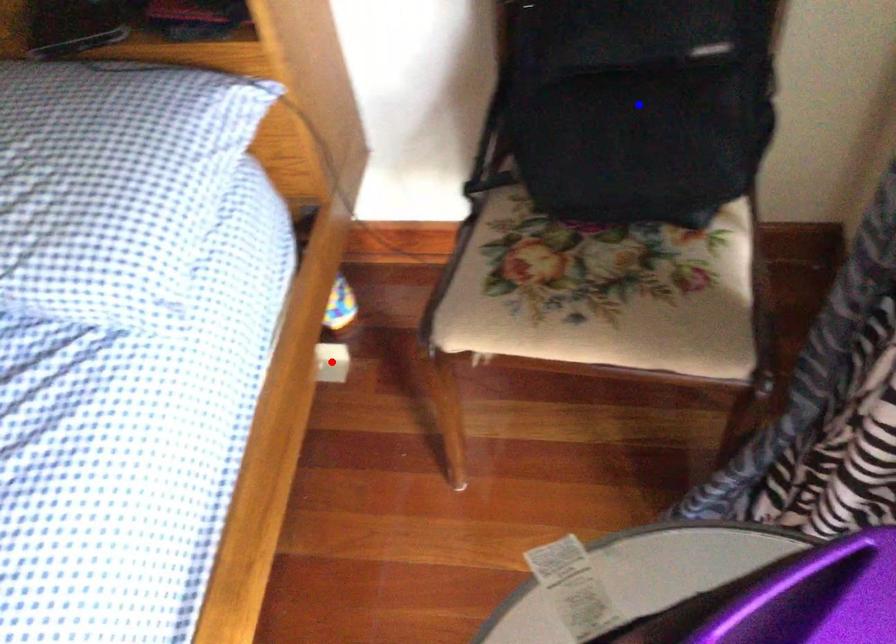
Question: Which of the two points in the image is closer to the camera?

Choices:
 (A) Blue point is closer.
 (B) Red point is closer.

Answer: (A)